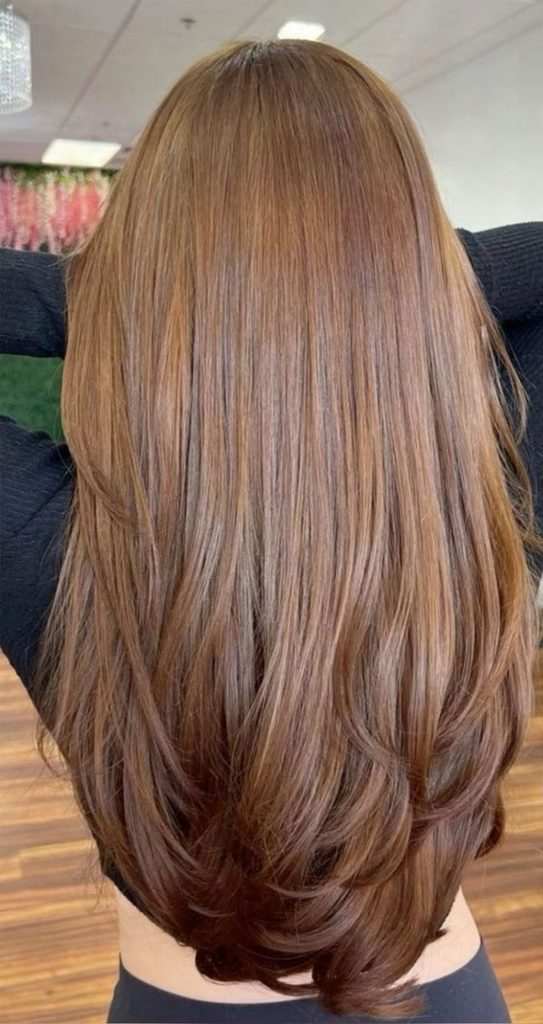
At what (x,y) coordinates should I click in order to perform the action: click on light gray tiled ceiling. Please return your answer as a coordinate pair (x, y). The image size is (543, 1024). Looking at the image, I should click on (81, 43).